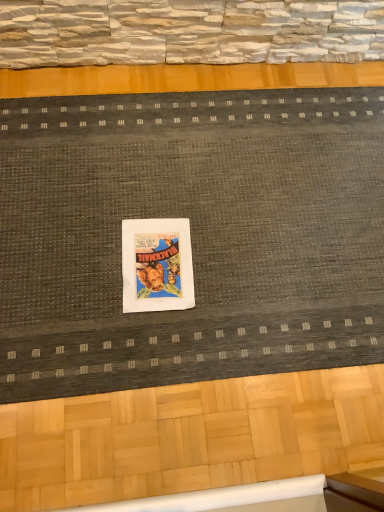
This screenshot has width=384, height=512. What do you see at coordinates (191, 236) in the screenshot?
I see `dark gray woven mat at center` at bounding box center [191, 236].

Image resolution: width=384 pixels, height=512 pixels. Identify the location of dark gray woven mat at center. (191, 236).

Identify the location of dark gray woven mat at center. (191, 236).